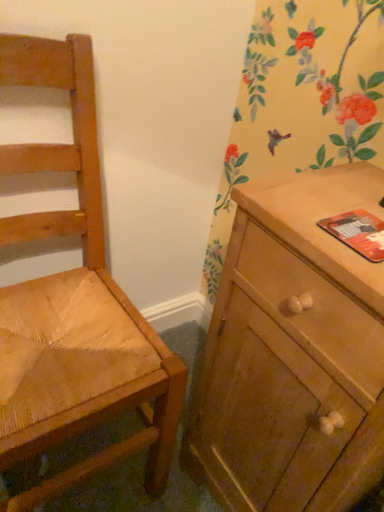
This screenshot has width=384, height=512. Find the location of `free point above wooden cabinet at right (from a real-world perspective)`. free point above wooden cabinet at right (from a real-world perspective) is located at coordinates (342, 207).